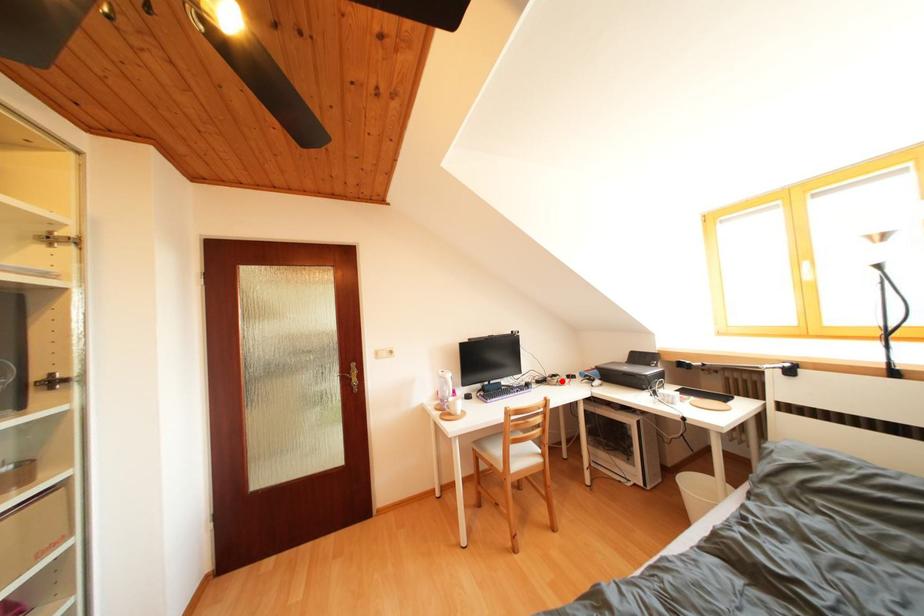
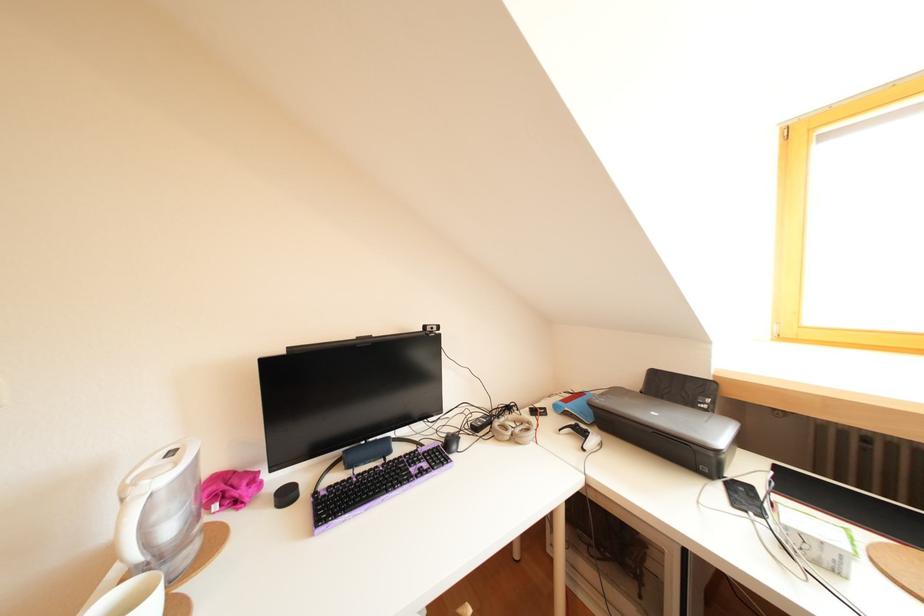
Question: A red point is marked in image1. In image2, is the corresponding 3D point closer to the camera or farther? Reply with the corresponding letter.

Choices:
 (A) The corresponding 3D point is closer.
 (B) The corresponding 3D point is farther.

Answer: (A)